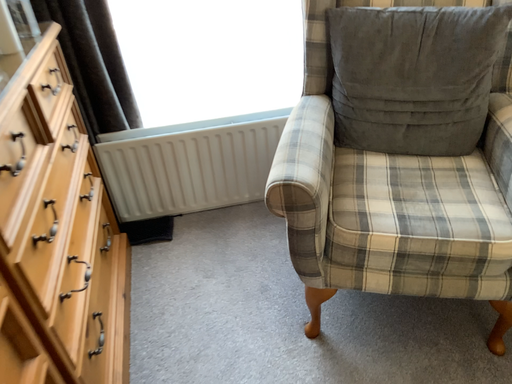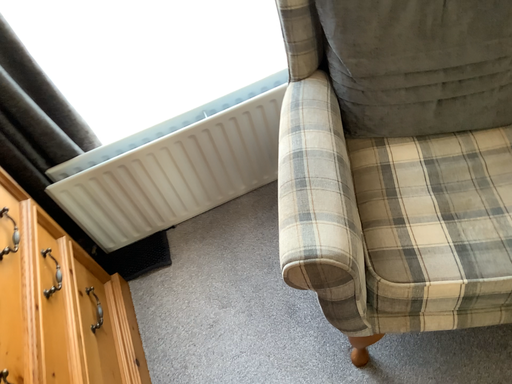
Question: Which way did the camera rotate in the video?

Choices:
 (A) rotated upward
 (B) rotated downward

Answer: (B)